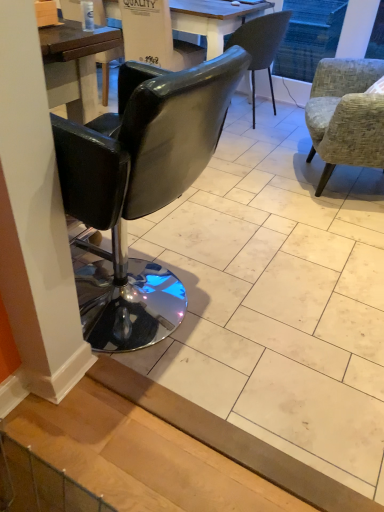
Question: Is black leather armchair at center positioned before textured gray fabric armchair at right, which is counted as the 2th chair, starting from the back?

Choices:
 (A) yes
 (B) no

Answer: (B)

Question: Is black leather armchair at center taller than textured gray fabric armchair at right, which ranks as the 3th chair in left-to-right order?

Choices:
 (A) yes
 (B) no

Answer: (B)

Question: From the image's perspective, is black leather armchair at center located above textured gray fabric armchair at right, which is counted as the 2th chair, starting from the back?

Choices:
 (A) yes
 (B) no

Answer: (A)

Question: Is textured gray fabric armchair at right, which is counted as the 2th chair, starting from the back, surrounded by black leather armchair at center?

Choices:
 (A) yes
 (B) no

Answer: (B)

Question: Considering the relative sizes of black leather armchair at center and textured gray fabric armchair at right, which is counted as the 2th chair, starting from the back, in the image provided, is black leather armchair at center shorter than textured gray fabric armchair at right, which is counted as the 2th chair, starting from the back,?

Choices:
 (A) yes
 (B) no

Answer: (A)

Question: In the image, is black leather armchair at center positioned in front of or behind matte gray chair at center, acting as the first chair starting from the back?

Choices:
 (A) front
 (B) behind

Answer: (A)

Question: Considering the positions of black leather armchair at center and matte gray chair at center, acting as the 3th chair starting from the front, in the image, is black leather armchair at center taller or shorter than matte gray chair at center, acting as the 3th chair starting from the front,?

Choices:
 (A) short
 (B) tall

Answer: (A)

Question: Considering the positions of black leather armchair at center and matte gray chair at center, acting as the 2th chair starting from the right, in the image, is black leather armchair at center bigger or smaller than matte gray chair at center, acting as the 2th chair starting from the right,?

Choices:
 (A) big
 (B) small

Answer: (B)

Question: Is point (193, 62) closer or farther from the camera than point (248, 31)?

Choices:
 (A) closer
 (B) farther

Answer: (B)

Question: Is point (139, 116) positioned closer to the camera than point (241, 31)?

Choices:
 (A) farther
 (B) closer

Answer: (B)

Question: Is black leather chair at left, which is counted as the third chair, starting from the back, in front of or behind matte gray chair at center, marked as the 2th chair in a left-to-right arrangement, in the image?

Choices:
 (A) behind
 (B) front

Answer: (B)

Question: In terms of width, does black leather chair at left, acting as the first chair starting from the left, look wider or thinner when compared to matte gray chair at center, acting as the 2th chair starting from the right?

Choices:
 (A) wide
 (B) thin

Answer: (A)

Question: From a real-world perspective, is black leather chair at left, which is counted as the third chair, starting from the back, positioned above or below matte gray chair at center, acting as the 3th chair starting from the front?

Choices:
 (A) above
 (B) below

Answer: (A)

Question: Is black leather armchair at center in front of or behind textured gray fabric armchair at right, which ranks as the 3th chair in left-to-right order, in the image?

Choices:
 (A) behind
 (B) front

Answer: (A)

Question: Considering the positions of point (135, 45) and point (344, 60), is point (135, 45) closer or farther from the camera than point (344, 60)?

Choices:
 (A) closer
 (B) farther

Answer: (B)